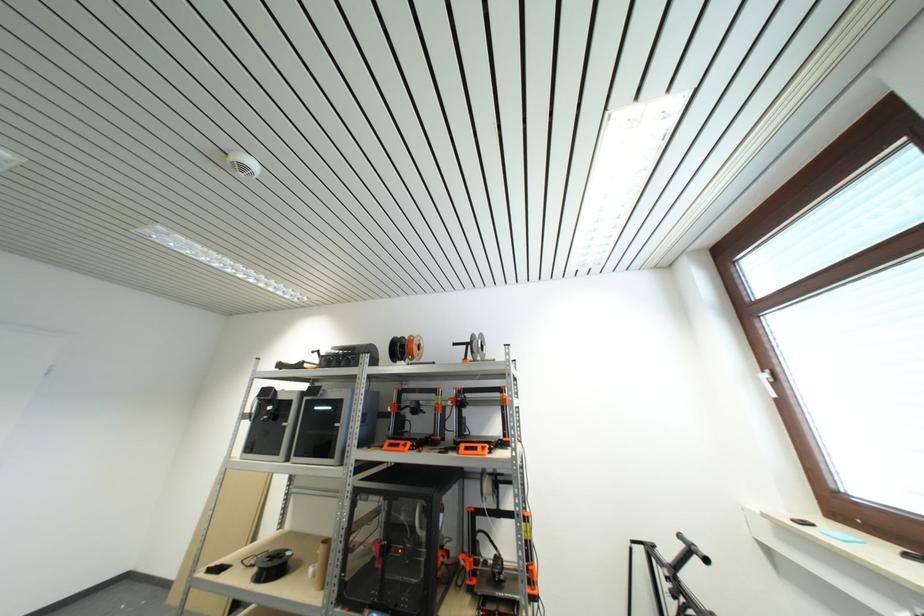
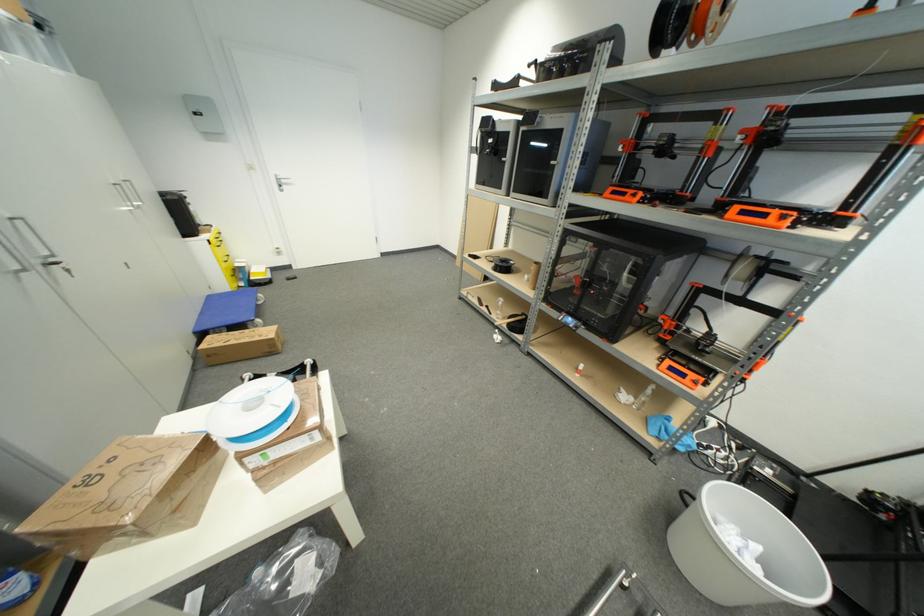
In the second image, find the point that corresponds to (480,451) in the first image.

(769, 217)